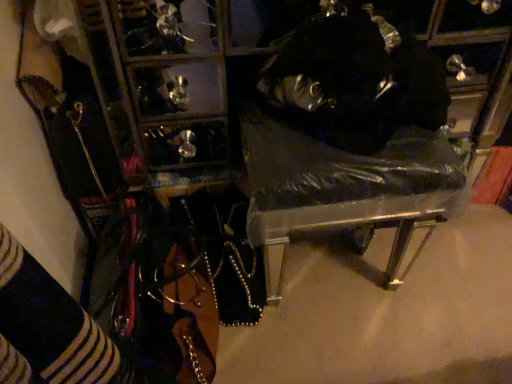
What are the coordinates of `fuzzy black hat at upper right` in the screenshot? It's located at (353, 80).

Describe the element at coordinates (353, 80) in the screenshot. I see `fuzzy black hat at upper right` at that location.

What is the approximate height of clear plastic bag at center?

clear plastic bag at center is 19.13 inches in height.

The width and height of the screenshot is (512, 384). What are the coordinates of `clear plastic bag at center` in the screenshot? It's located at (349, 139).

Measure the distance between clear plastic bag at center and camera.

They are 30.81 inches apart.

What do you see at coordinates (349, 139) in the screenshot? The width and height of the screenshot is (512, 384). I see `clear plastic bag at center` at bounding box center [349, 139].

At what (x,y) coordinates should I click in order to perform the action: click on fuzzy black hat at upper right. Please return your answer as a coordinate pair (x, y). Looking at the image, I should click on (353, 80).

Based on their positions, is clear plastic bag at center located to the left or right of fuzzy black hat at upper right?

Based on their positions, clear plastic bag at center is located to the left of fuzzy black hat at upper right.

In the scene shown: Considering the relative positions of clear plastic bag at center and fuzzy black hat at upper right in the image provided, is clear plastic bag at center in front of fuzzy black hat at upper right?

No.

Which is farther from the camera, (424, 67) or (313, 89)?

The point (424, 67) is farther from the camera.

From the image's perspective, is clear plastic bag at center positioned above or below fuzzy black hat at upper right?

From the image's perspective, clear plastic bag at center appears below fuzzy black hat at upper right.

From a real-world perspective, between clear plastic bag at center and fuzzy black hat at upper right, who is vertically lower?

In real-world perspective, clear plastic bag at center is lower.

Between clear plastic bag at center and fuzzy black hat at upper right, which one has smaller width?

With smaller width is fuzzy black hat at upper right.

Is clear plastic bag at center taller than fuzzy black hat at upper right?

Correct, clear plastic bag at center is much taller as fuzzy black hat at upper right.

Between clear plastic bag at center and fuzzy black hat at upper right, which one has smaller size?

With smaller size is fuzzy black hat at upper right.

Can we say clear plastic bag at center lies outside fuzzy black hat at upper right?

That's correct, clear plastic bag at center is outside of fuzzy black hat at upper right.

Is clear plastic bag at center with fuzzy black hat at upper right?

Indeed, clear plastic bag at center and fuzzy black hat at upper right are beside each other and touching.

From the picture: Could you tell me if clear plastic bag at center is turned towards fuzzy black hat at upper right?

No, clear plastic bag at center is not aimed at fuzzy black hat at upper right.

Can you tell me how much clear plastic bag at center and fuzzy black hat at upper right differ in facing direction?

They differ by 3.06 degrees in their facing directions.

Where is `furniture located behind the fuzzy black hat at upper right`? furniture located behind the fuzzy black hat at upper right is located at coordinates (349, 139).

Can you confirm if fuzzy black hat at upper right is positioned to the left of clear plastic bag at center?

No, fuzzy black hat at upper right is not to the left of clear plastic bag at center.

Looking at this image, considering their positions, is fuzzy black hat at upper right located in front of or behind clear plastic bag at center?

fuzzy black hat at upper right is positioned closer to the viewer than clear plastic bag at center.

Does point (286, 61) come in front of point (242, 132)?

Yes, it is.

From the image's perspective, would you say fuzzy black hat at upper right is positioned over clear plastic bag at center?

Yes.

From a real-world perspective, which object stands above the other?

In real-world perspective, fuzzy black hat at upper right is above.

Is fuzzy black hat at upper right wider or thinner than clear plastic bag at center?

Clearly, fuzzy black hat at upper right has less width compared to clear plastic bag at center.

Considering the sizes of fuzzy black hat at upper right and clear plastic bag at center in the image, is fuzzy black hat at upper right taller or shorter than clear plastic bag at center?

A: In the image, fuzzy black hat at upper right appears to be shorter than clear plastic bag at center.

Considering the relative sizes of fuzzy black hat at upper right and clear plastic bag at center in the image provided, is fuzzy black hat at upper right bigger than clear plastic bag at center?

No, fuzzy black hat at upper right is not bigger than clear plastic bag at center.

Is fuzzy black hat at upper right spatially inside clear plastic bag at center, or outside of it?

fuzzy black hat at upper right is not inside clear plastic bag at center, it's outside.

Would you consider fuzzy black hat at upper right to be distant from clear plastic bag at center?

No.

Is fuzzy black hat at upper right facing towards clear plastic bag at center?

No, fuzzy black hat at upper right is not aimed at clear plastic bag at center.

Locate an element on the screen. This screenshot has height=384, width=512. furniture on the left side of fuzzy black hat at upper right is located at coordinates (349, 139).

At what (x,y) coordinates should I click in order to perform the action: click on person located on the right of clear plastic bag at center. Please return your answer as a coordinate pair (x, y). Looking at the image, I should click on (353, 80).

Locate an element on the screen. person that appears in front of the clear plastic bag at center is located at coordinates (353, 80).